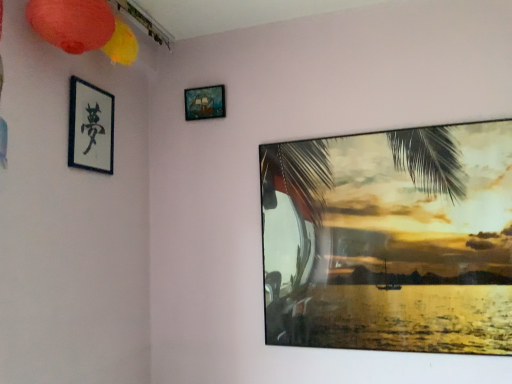
Question: Is matte paper lantern at upper left positioned with its back to metallic glossy picture frame at upper right, placed as the 1th picture frame when sorted from right to left?

Choices:
 (A) yes
 (B) no

Answer: (B)

Question: Is matte paper lantern at upper left far from metallic glossy picture frame at upper right, the third picture frame when ordered from left to right?

Choices:
 (A) no
 (B) yes

Answer: (B)

Question: Considering the relative positions of matte paper lantern at upper left and metallic glossy picture frame at upper right, placed as the 1th picture frame when sorted from right to left, in the image provided, is matte paper lantern at upper left to the left of metallic glossy picture frame at upper right, placed as the 1th picture frame when sorted from right to left, from the viewer's perspective?

Choices:
 (A) yes
 (B) no

Answer: (A)

Question: Would you say metallic glossy picture frame at upper right, the third picture frame when ordered from left to right, is part of matte paper lantern at upper left's contents?

Choices:
 (A) no
 (B) yes

Answer: (A)

Question: Is matte paper lantern at upper left wider than metallic glossy picture frame at upper right, placed as the 1th picture frame when sorted from right to left?

Choices:
 (A) yes
 (B) no

Answer: (A)

Question: Is wooden ship painting at upper center, the 2th picture frame from the right, wider or thinner than black paper at upper left, which ranks as the 3th picture frame in right-to-left order?

Choices:
 (A) wide
 (B) thin

Answer: (B)

Question: Based on their positions, is wooden ship painting at upper center, the 2th picture frame from the right, located to the left or right of black paper at upper left, which ranks as the 3th picture frame in right-to-left order?

Choices:
 (A) left
 (B) right

Answer: (B)

Question: Is wooden ship painting at upper center, the second picture frame when ordered from left to right, taller or shorter than black paper at upper left, the 1th picture frame when ordered from left to right?

Choices:
 (A) short
 (B) tall

Answer: (A)

Question: From a real-world perspective, relative to black paper at upper left, which ranks as the 3th picture frame in right-to-left order, is wooden ship painting at upper center, the 2th picture frame from the right, vertically above or below?

Choices:
 (A) above
 (B) below

Answer: (A)

Question: Is point (208, 89) closer or farther from the camera than point (348, 183)?

Choices:
 (A) closer
 (B) farther

Answer: (B)

Question: In terms of height, does wooden ship painting at upper center, the 2th picture frame from the right, look taller or shorter compared to metallic glossy picture frame at upper right, the third picture frame when ordered from left to right?

Choices:
 (A) short
 (B) tall

Answer: (A)

Question: From the image's perspective, is wooden ship painting at upper center, the 2th picture frame from the right, located above or below metallic glossy picture frame at upper right, the third picture frame when ordered from left to right?

Choices:
 (A) below
 (B) above

Answer: (B)

Question: Based on their positions, is wooden ship painting at upper center, the second picture frame when ordered from left to right, located to the left or right of metallic glossy picture frame at upper right, the third picture frame when ordered from left to right?

Choices:
 (A) right
 (B) left

Answer: (B)

Question: Would you say matte paper lantern at upper left is inside or outside black paper at upper left, the 1th picture frame when ordered from left to right?

Choices:
 (A) inside
 (B) outside

Answer: (B)

Question: Considering the positions of matte paper lantern at upper left and black paper at upper left, the 1th picture frame when ordered from left to right, in the image, is matte paper lantern at upper left wider or thinner than black paper at upper left, the 1th picture frame when ordered from left to right,?

Choices:
 (A) wide
 (B) thin

Answer: (A)